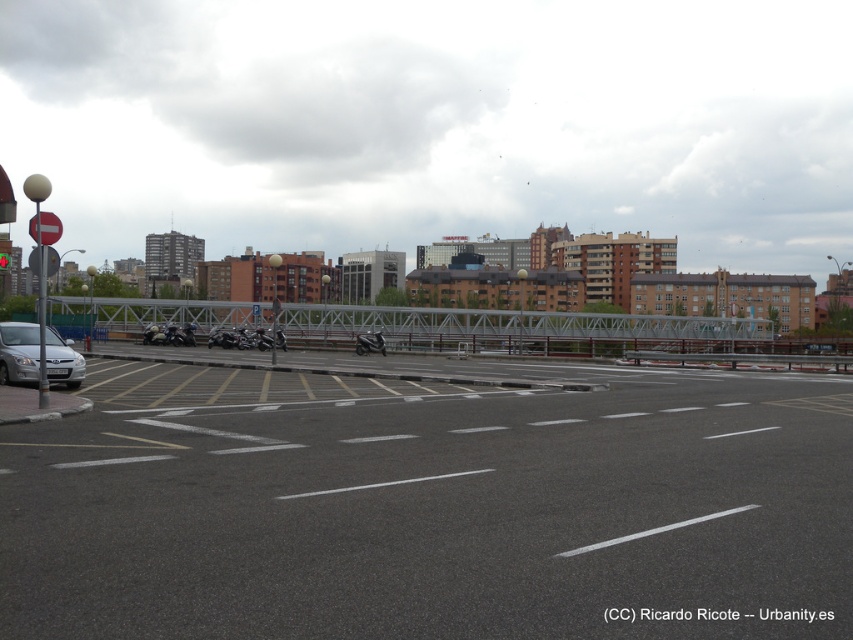
Does metallic gray bridge at center have a greater height compared to shiny black motorcycle at center?

Indeed, metallic gray bridge at center has a greater height compared to shiny black motorcycle at center.

Does metallic gray bridge at center appear over shiny black motorcycle at center?

Indeed, metallic gray bridge at center is positioned over shiny black motorcycle at center.

Who is more distant from viewer, [735,320] or [370,336]?

The point [735,320] is more distant.

The image size is (853, 640). What are the coordinates of `metallic gray bridge at center` in the screenshot? It's located at (518, 326).

Is silver metallic car at lower left above shiny black motorcycle at center?

Yes.

Which is behind, point (22, 369) or point (369, 337)?

Point (369, 337)

Between point (47, 337) and point (381, 339), which one is positioned in front?

Positioned in front is point (47, 337).

This screenshot has width=853, height=640. What are the coordinates of `silver metallic car at lower left` in the screenshot? It's located at (19, 352).

Between metallic gray bridge at center and silver metallic car at lower left, which one is positioned higher?

metallic gray bridge at center is above.

Does point (691, 352) come closer to viewer compared to point (10, 380)?

That is False.

Where is `metallic gray bridge at center`? The image size is (853, 640). metallic gray bridge at center is located at coordinates (518, 326).